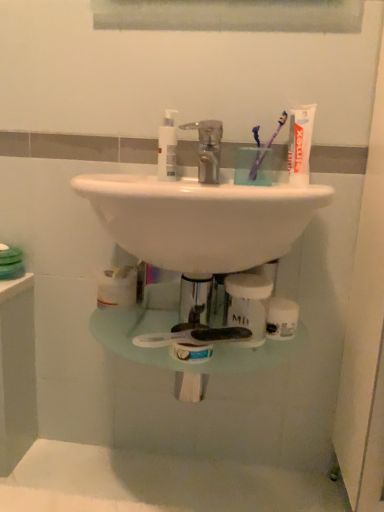
Question: From the image's perspective, is polished chrome faucet at center on top of purple translucent toothbrush at upper center, which is the 2th toothbrush in right-to-left order?

Choices:
 (A) no
 (B) yes

Answer: (A)

Question: From a real-world perspective, does polished chrome faucet at center sit lower than purple translucent toothbrush at upper center, the 1th toothbrush viewed from the left?

Choices:
 (A) no
 (B) yes

Answer: (B)

Question: Can purple translucent toothbrush at upper center, which is the 2th toothbrush in right-to-left order, be found inside polished chrome faucet at center?

Choices:
 (A) no
 (B) yes

Answer: (A)

Question: Does polished chrome faucet at center lie behind purple translucent toothbrush at upper center, which is the 2th toothbrush in right-to-left order?

Choices:
 (A) yes
 (B) no

Answer: (B)

Question: Is polished chrome faucet at center taller than purple translucent toothbrush at upper center, the 1th toothbrush viewed from the left?

Choices:
 (A) no
 (B) yes

Answer: (A)

Question: Can you confirm if polished chrome faucet at center is smaller than purple translucent toothbrush at upper center, the 1th toothbrush viewed from the left?

Choices:
 (A) no
 (B) yes

Answer: (A)

Question: Does purple translucent toothbrush at upper center, the 1th toothbrush viewed from the left, turn towards white matte tube of toothpaste at upper right?

Choices:
 (A) yes
 (B) no

Answer: (B)

Question: Considering the relative positions of purple translucent toothbrush at upper center, the 1th toothbrush viewed from the left, and white matte tube of toothpaste at upper right in the image provided, is purple translucent toothbrush at upper center, the 1th toothbrush viewed from the left, to the left of white matte tube of toothpaste at upper right from the viewer's perspective?

Choices:
 (A) yes
 (B) no

Answer: (A)

Question: Is purple translucent toothbrush at upper center, the 1th toothbrush viewed from the left, oriented away from white matte tube of toothpaste at upper right?

Choices:
 (A) no
 (B) yes

Answer: (A)

Question: Can you confirm if purple translucent toothbrush at upper center, which is the 2th toothbrush in right-to-left order, is shorter than white matte tube of toothpaste at upper right?

Choices:
 (A) no
 (B) yes

Answer: (B)

Question: Does purple translucent toothbrush at upper center, which is the 2th toothbrush in right-to-left order, touch white matte tube of toothpaste at upper right?

Choices:
 (A) yes
 (B) no

Answer: (B)

Question: From the image's perspective, is purple translucent toothbrush at upper center, the 1th toothbrush viewed from the left, above white matte tube of toothpaste at upper right?

Choices:
 (A) yes
 (B) no

Answer: (A)

Question: Does white glossy sink at center have a greater width compared to clear plastic jar at center, acting as the 1th toiletry starting from the bottom?

Choices:
 (A) yes
 (B) no

Answer: (A)